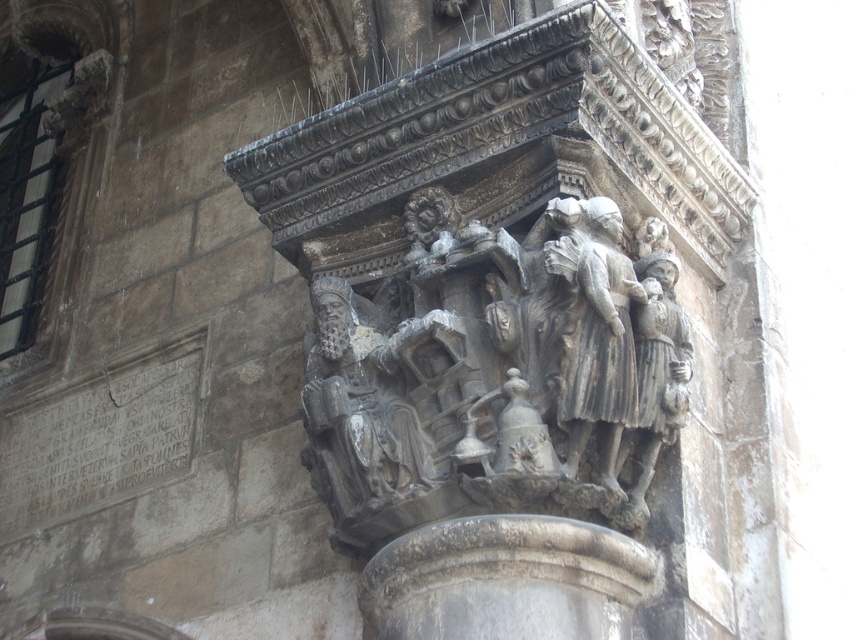
Can you confirm if gray stone carving at center is positioned to the right of gray stone figures at center?

No, gray stone carving at center is not to the right of gray stone figures at center.

Is gray stone carving at center to the left of gray stone figures at center from the viewer's perspective?

Indeed, gray stone carving at center is positioned on the left side of gray stone figures at center.

Is point (270, 172) positioned in front of point (630, 472)?

No, it is behind (630, 472).

Identify the location of gray stone carving at center. (505, 326).